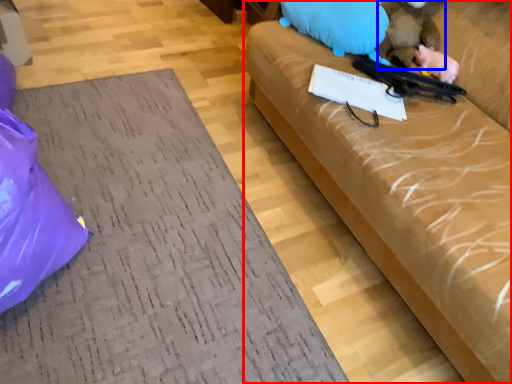
Question: Among these objects, which one is farthest to the camera, studio couch (highlighted by a red box) or animal (highlighted by a blue box)?

Choices:
 (A) studio couch
 (B) animal

Answer: (B)